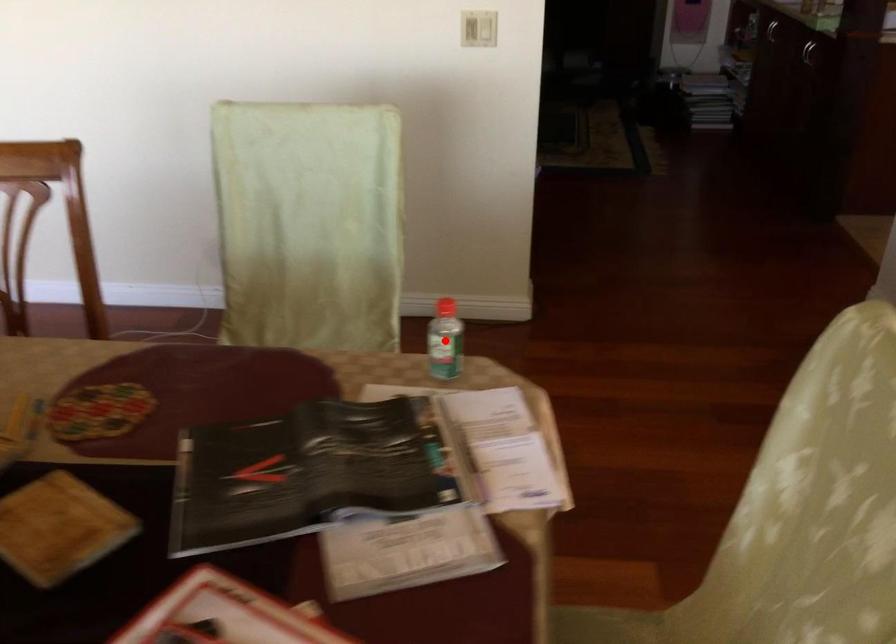
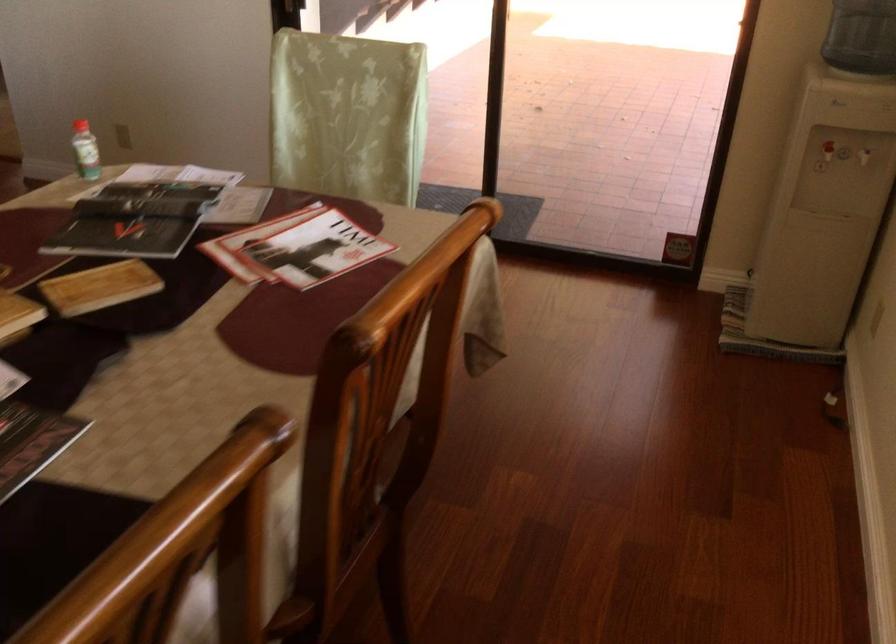
Question: I am providing you with two images of the same scene from different viewpoints. A red point is marked on the first image. Can you still see the location of the red point in image 2?

Choices:
 (A) Yes
 (B) No

Answer: (B)